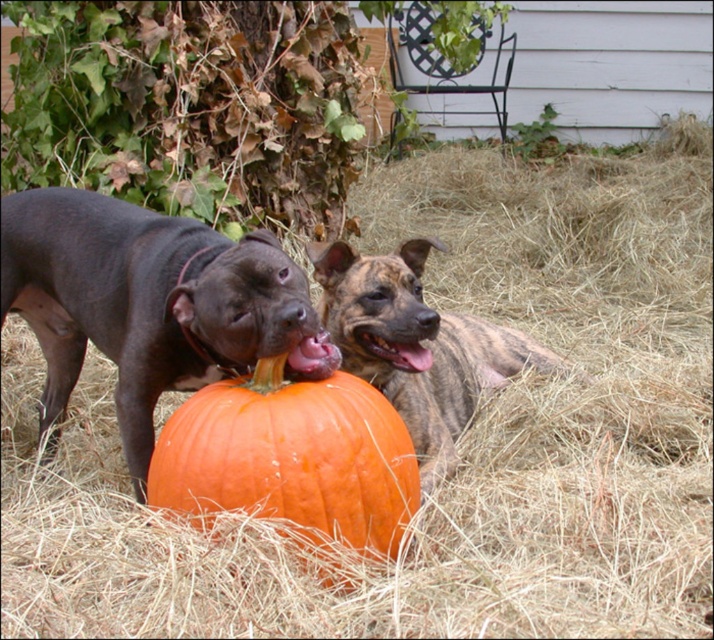
You are a photographer setting up a camera to capture both the black smooth dog at center and the orange matte pumpkin at center in the same frame. Based on their sizes, which object should you focus on first to ensure both fit comfortably in the frame?

The black smooth dog at center is wider than the orange matte pumpkin at center, so focusing on the dog first will help ensure both fit comfortably in the frame.

You are a photographer trying to capture both the black smooth dog at center and the brindle fur dog at center in a single frame. Based on their positions, which dog should you adjust your camera angle to focus on first to ensure both are in the shot?

The black smooth dog at center is to the left of the brindle fur dog at center, so you should focus on the brindle fur dog at center first to ensure both are in the frame.

You are a photographer setting up a camera to capture both the black smooth dog at center and the brindle fur dog at center in a single shot. The camera has a focal length of 50mm. Based on their distance apart, would you need to adjust the camera angle or zoom to ensure both dogs are fully visible in the frame?

The black smooth dog at center is 25.87 inches away from brindle fur dog at center. With a 50mm focal length, which is considered a standard lens, the field of view should comfortably include both dogs without needing significant adjustments. Ensure the camera is positioned centrally between them to maintain both in frame.